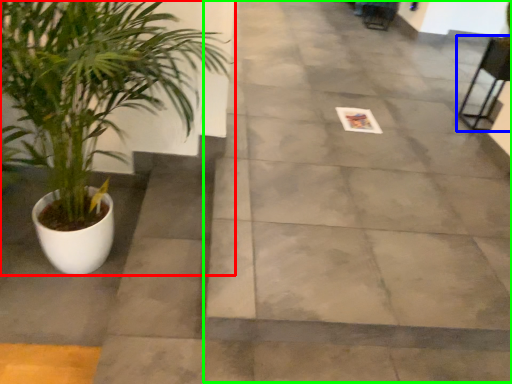
Question: Considering the real-world distances, which object is farthest from houseplant (highlighted by a red box)? chair (highlighted by a blue box) or pavement (highlighted by a green box)?

Choices:
 (A) chair
 (B) pavement

Answer: (A)